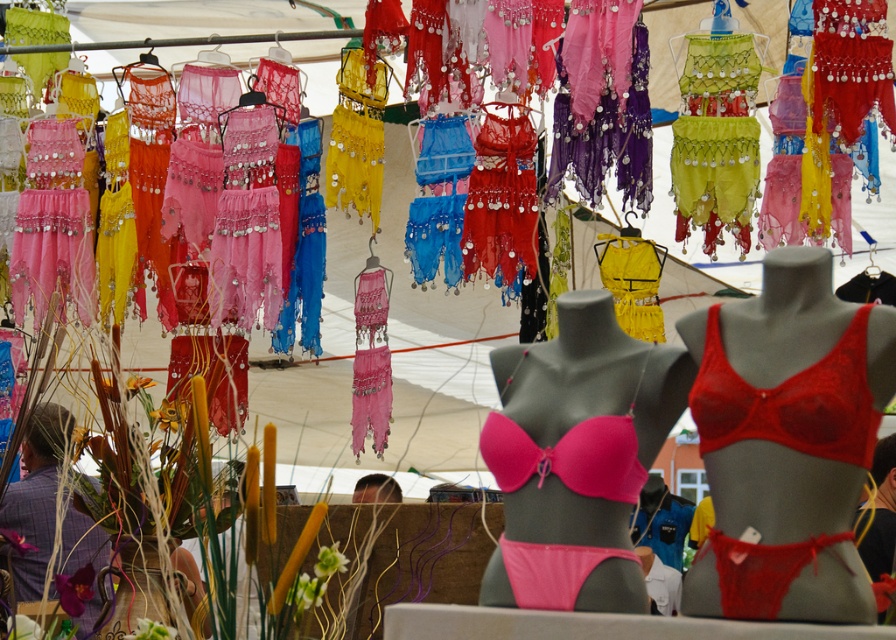
You are a dancer preparing for a performance and need to place your lace red bra at center and pink matte bikini at center into a single garment bag that is 5 inches wide. Will both items fit side by side in the bag?

The distance between the lace red bra at center and pink matte bikini at center is 4.87 inches, so they can fit side by side in a 5 inch wide garment bag with a small amount of space remaining.

You are a customer at the market and want to know if the pink matte bikini at center and the red lace bikini top at center are close enough to be considered a matching set. The store requires items to be within 5 inches of each other to qualify. Can they be paired together?

The pink matte bikini at center and red lace bikini top at center are 4.99 inches apart from each other, which is within the 5 inch requirement, so they can be paired together as a matching set.

You are a customer at the market and want to buy both the pink matte bikini at center and the red lace bikini top at center. If you first pick up the one on the left, which one will you have in your hand?

The pink matte bikini at center is to the left of the red lace bikini top at center, so you will have the pink matte bikini at center in your hand.